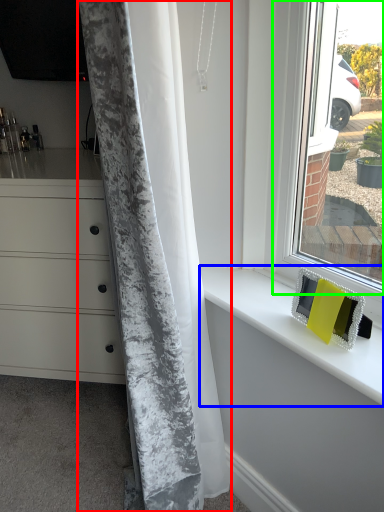
Question: Based on their relative distances, which object is nearer to curtain (highlighted by a red box)? Choose from counter top (highlighted by a blue box) and window (highlighted by a green box).

Choices:
 (A) counter top
 (B) window

Answer: (A)